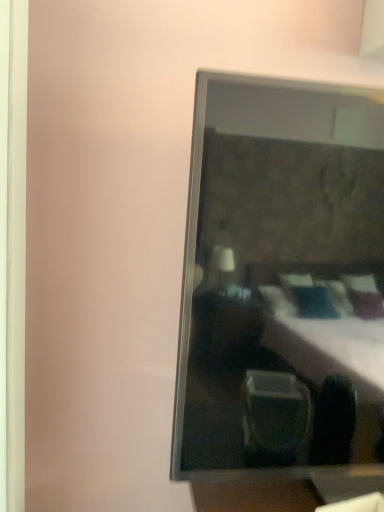
The width and height of the screenshot is (384, 512). What do you see at coordinates (281, 281) in the screenshot?
I see `matte black mirror at center` at bounding box center [281, 281].

Measure the distance between matte black mirror at center and camera.

The depth of matte black mirror at center is 50.60 centimeters.

The height and width of the screenshot is (512, 384). Identify the location of matte black mirror at center. (281, 281).

The height and width of the screenshot is (512, 384). What are the coordinates of `matte black mirror at center` in the screenshot? It's located at (281, 281).